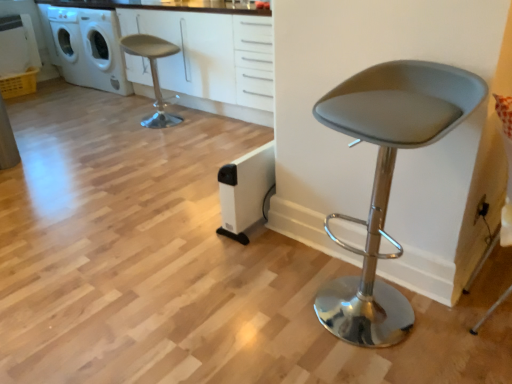
This screenshot has width=512, height=384. Describe the element at coordinates (89, 48) in the screenshot. I see `white plastic washing machine at upper left` at that location.

What do you see at coordinates (153, 73) in the screenshot? I see `matte gray stool at upper left, which is the first chair from top to bottom` at bounding box center [153, 73].

What do you see at coordinates (387, 179) in the screenshot? I see `matte gray stool at center, placed as the first chair when sorted from right to left` at bounding box center [387, 179].

Where is `white plastic washing machine at upper left`? The image size is (512, 384). white plastic washing machine at upper left is located at coordinates (89, 48).

In the scene shown: In terms of size, does matte gray stool at upper left, the second chair from the right, appear bigger or smaller than matte gray stool at center, the second chair viewed from the left?

Clearly, matte gray stool at upper left, the second chair from the right, is smaller in size than matte gray stool at center, the second chair viewed from the left.

Which is more to the left, matte gray stool at upper left, which ranks as the 1th chair in back-to-front order, or matte gray stool at center, positioned as the second chair in top-to-bottom order?

Positioned to the left is matte gray stool at upper left, which ranks as the 1th chair in back-to-front order.

Is matte gray stool at upper left, arranged as the 1th chair when viewed from the left, looking in the opposite direction of matte gray stool at center, marked as the 1th chair in a bottom-to-top arrangement?

matte gray stool at upper left, arranged as the 1th chair when viewed from the left, does not have its back to matte gray stool at center, marked as the 1th chair in a bottom-to-top arrangement.

The height and width of the screenshot is (384, 512). I want to click on chair to the right of matte gray stool at upper left, the second chair from the right, so click(x=387, y=179).

This screenshot has height=384, width=512. What are the coordinates of `the 2nd chair positioned below the white matte cabinet at upper center (from a real-world perspective)` in the screenshot? It's located at (153, 73).

Is matte gray stool at upper left, which is the first chair from top to bottom, a part of white matte cabinet at upper center?

No, matte gray stool at upper left, which is the first chair from top to bottom, is located outside of white matte cabinet at upper center.

From a real-world perspective, relative to matte gray stool at upper left, which ranks as the 1th chair in back-to-front order, is white matte cabinet at upper center vertically above or below?

In terms of real-world spatial position, white matte cabinet at upper center is above matte gray stool at upper left, which ranks as the 1th chair in back-to-front order.

In terms of width, does matte gray stool at center, positioned as the second chair in top-to-bottom order, look wider or thinner when compared to white plastic washing machine at upper left?

In the image, matte gray stool at center, positioned as the second chair in top-to-bottom order, appears to be more narrow than white plastic washing machine at upper left.

From the image's perspective, would you say matte gray stool at center, the second chair viewed from the left, is shown under white plastic washing machine at upper left?

Correct, matte gray stool at center, the second chair viewed from the left, appears lower than white plastic washing machine at upper left in the image.

Starting from the white plastic washing machine at upper left, which chair is the 2nd one in front? Please provide its 2D coordinates.

[(387, 179)]

Between matte gray stool at center, which is the 2th chair from back to front, and white plastic washing machine at upper left, which one has less height?

matte gray stool at center, which is the 2th chair from back to front.

Can you tell me how much matte gray stool at center, marked as the 1th chair in a bottom-to-top arrangement, and white matte cabinet at upper center differ in facing direction?

14.1 degrees.

Which is more to the left, matte gray stool at center, positioned as the 1th chair in front-to-back order, or white matte cabinet at upper center?

white matte cabinet at upper center.

Which is more distant, (384, 213) or (237, 51)?

The point (237, 51) is more distant.

Locate an element on the screen. cabinetry that is on the left side of matte gray stool at center, positioned as the 1th chair in front-to-back order is located at coordinates (213, 60).

Which of these two, matte gray stool at upper left, positioned as the second chair in bottom-to-top order, or white matte cabinet at upper center, is thinner?

matte gray stool at upper left, positioned as the second chair in bottom-to-top order.

Consider the image. Considering the relative positions of matte gray stool at upper left, positioned as the second chair in bottom-to-top order, and white matte cabinet at upper center in the image provided, is matte gray stool at upper left, positioned as the second chair in bottom-to-top order, in front of white matte cabinet at upper center?

That is False.

Could you tell me if matte gray stool at upper left, which ranks as the 1th chair in back-to-front order, is turned towards white matte cabinet at upper center?

No.

Is white matte cabinet at upper center aimed at white plastic washing machine at upper left?

No, white matte cabinet at upper center does not turn towards white plastic washing machine at upper left.

Is white matte cabinet at upper center wider or thinner than white plastic washing machine at upper left?

Clearly, white matte cabinet at upper center has less width compared to white plastic washing machine at upper left.

Locate an element on the screen. Image resolution: width=512 pixels, height=384 pixels. washing machine above the white matte cabinet at upper center (from the image's perspective) is located at coordinates (89, 48).

Looking at this image, considering the positions of objects white matte cabinet at upper center and white plastic washing machine at upper left in the image provided, who is more to the left, white matte cabinet at upper center or white plastic washing machine at upper left?

white plastic washing machine at upper left is more to the left.

Which object is thinner, white matte cabinet at upper center or matte gray stool at center, placed as the first chair when sorted from right to left?

Thinner between the two is matte gray stool at center, placed as the first chair when sorted from right to left.

Which is behind, white matte cabinet at upper center or matte gray stool at center, which is the 2th chair from back to front?

white matte cabinet at upper center is further from the camera.

Can you confirm if white matte cabinet at upper center is smaller than matte gray stool at center, placed as the first chair when sorted from right to left?

No.

Which object is positioned more to the left, white matte cabinet at upper center or matte gray stool at center, positioned as the 1th chair in front-to-back order?

white matte cabinet at upper center is more to the left.

Identify the location of chair on the right side of matte gray stool at upper left, arranged as the 1th chair when viewed from the left. This screenshot has width=512, height=384. (387, 179).

Locate an element on the screen. chair lying behind the white matte cabinet at upper center is located at coordinates (153, 73).

Consider the image. Estimate the real-world distances between objects in this image. Which object is further from white matte cabinet at upper center, white plastic washing machine at upper left or matte gray stool at center, marked as the 1th chair in a bottom-to-top arrangement?

matte gray stool at center, marked as the 1th chair in a bottom-to-top arrangement, is positioned further to the anchor white matte cabinet at upper center.

Considering their positions, is white plastic washing machine at upper left positioned closer to matte gray stool at upper left, the second chair from the right, than matte gray stool at center, positioned as the second chair in top-to-bottom order?

white plastic washing machine at upper left lies closer to matte gray stool at upper left, the second chair from the right, than the other object.

Looking at the image, which one is located closer to matte gray stool at center, which is the 2th chair from back to front, white matte cabinet at upper center or matte gray stool at upper left, the second chair from the right?

The object closer to matte gray stool at center, which is the 2th chair from back to front, is white matte cabinet at upper center.

Considering their positions, is white plastic washing machine at upper left positioned closer to matte gray stool at upper left, marked as the second chair in a front-to-back arrangement, than white matte cabinet at upper center?

white matte cabinet at upper center lies closer to matte gray stool at upper left, marked as the second chair in a front-to-back arrangement, than the other object.

Considering their positions, is white plastic washing machine at upper left positioned closer to matte gray stool at center, which is the 2th chair from back to front, than white matte cabinet at upper center?

white matte cabinet at upper center.

Which object lies further to the anchor point matte gray stool at center, positioned as the 1th chair in front-to-back order, matte gray stool at upper left, the second chair from the right, or white plastic washing machine at upper left?

Among the two, white plastic washing machine at upper left is located further to matte gray stool at center, positioned as the 1th chair in front-to-back order.

Considering their positions, is matte gray stool at upper left, positioned as the second chair in bottom-to-top order, positioned closer to white matte cabinet at upper center than matte gray stool at center, positioned as the 1th chair in front-to-back order?

matte gray stool at upper left, positioned as the second chair in bottom-to-top order, is positioned closer to the anchor white matte cabinet at upper center.

Considering their positions, is matte gray stool at upper left, which ranks as the 1th chair in back-to-front order, positioned closer to white plastic washing machine at upper left than matte gray stool at center, positioned as the 1th chair in front-to-back order?

matte gray stool at upper left, which ranks as the 1th chair in back-to-front order, lies closer to white plastic washing machine at upper left than the other object.

Image resolution: width=512 pixels, height=384 pixels. I want to click on cabinetry between matte gray stool at center, positioned as the second chair in top-to-bottom order, and matte gray stool at upper left, positioned as the second chair in bottom-to-top order, from front to back, so click(x=213, y=60).

Locate an element on the screen. The width and height of the screenshot is (512, 384). chair located between matte gray stool at center, placed as the first chair when sorted from right to left, and white plastic washing machine at upper left in the depth direction is located at coordinates (153, 73).

In order to click on cabinetry between matte gray stool at center, positioned as the 1th chair in front-to-back order, and white plastic washing machine at upper left from front to back in this screenshot , I will do `click(213, 60)`.

Where is `chair located between white plastic washing machine at upper left and white matte cabinet at upper center in the left-right direction`? chair located between white plastic washing machine at upper left and white matte cabinet at upper center in the left-right direction is located at coordinates (153, 73).